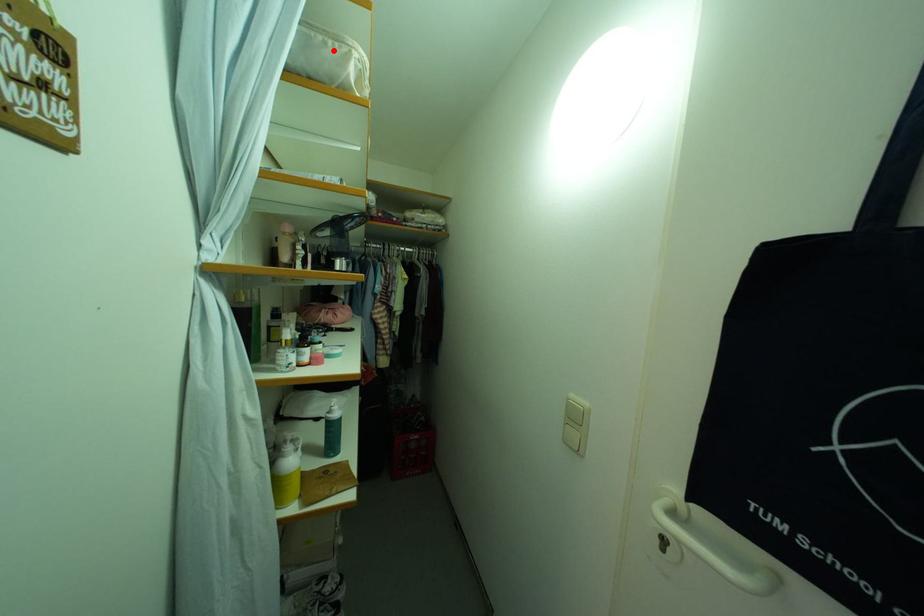
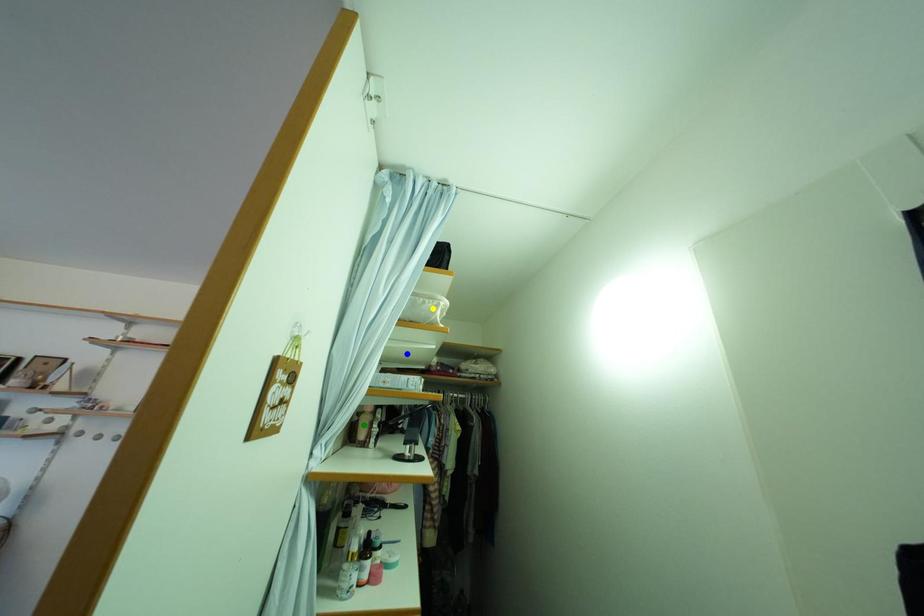
Question: I am providing you with two images of the same scene from different viewpoints. A red point is marked on the first image. You are given multiple points on the second image. Which point in image 2 is actually the same real-world point as the red point in image 1?

Choices:
 (A) green point
 (B) blue point
 (C) yellow point

Answer: (C)